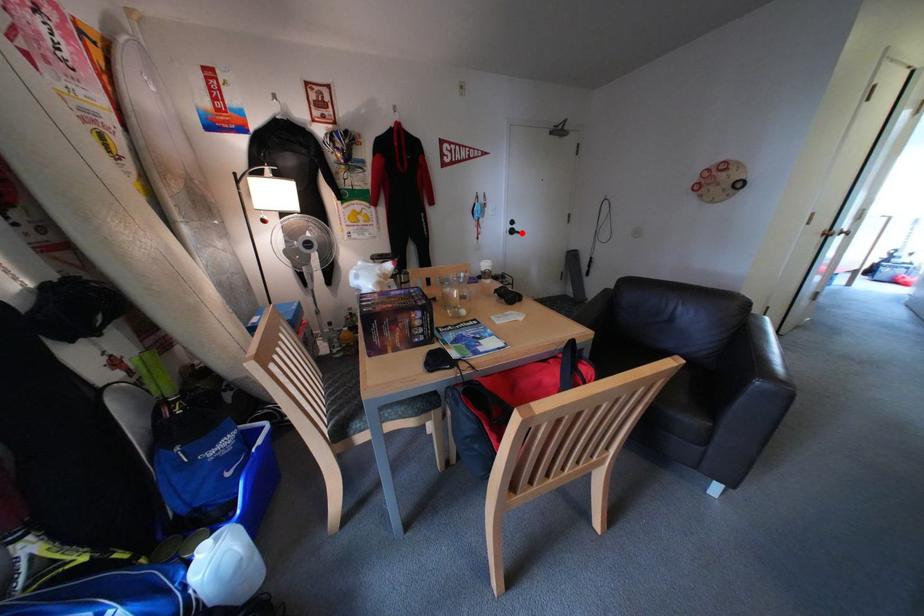
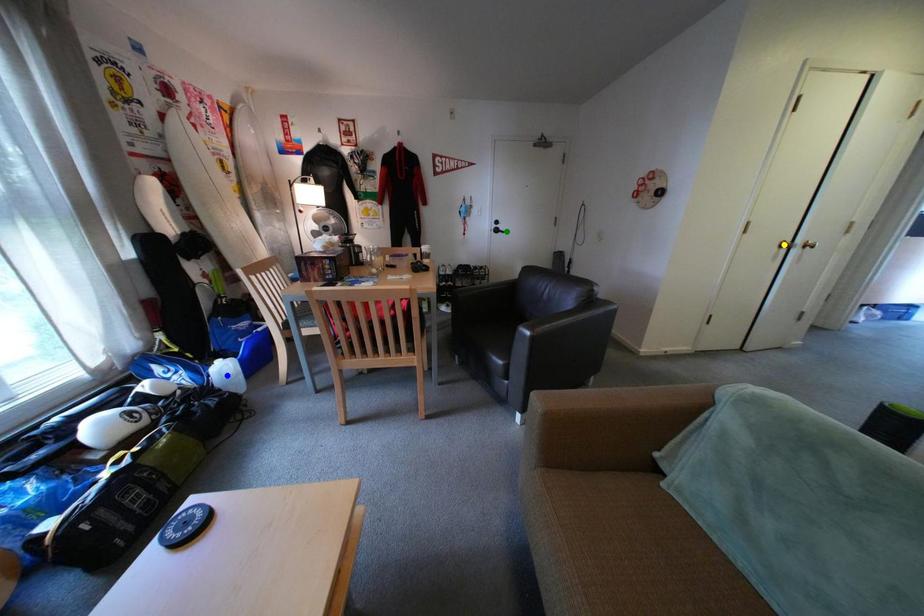
Question: I am providing you with two images of the same scene from different viewpoints. A red point is marked on the first image. You are given multiple points on the second image. Which point in image 2 is actually the same real-world point as the red point in image 1?

Choices:
 (A) blue point
 (B) green point
 (C) yellow point

Answer: (B)